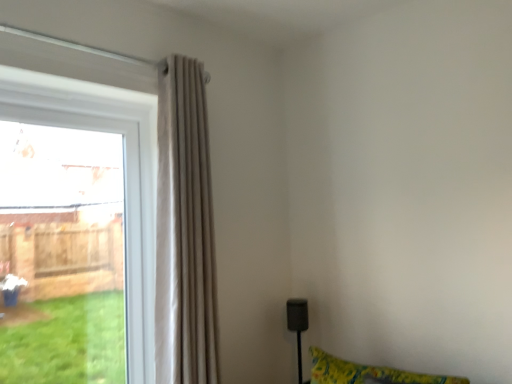
I want to click on beige fabric curtain at left, so click(x=184, y=230).

Describe the element at coordinates (184, 230) in the screenshot. I see `beige fabric curtain at left` at that location.

Image resolution: width=512 pixels, height=384 pixels. What do you see at coordinates (146, 192) in the screenshot?
I see `clear glass window at left` at bounding box center [146, 192].

Where is `clear glass window at left`? clear glass window at left is located at coordinates (146, 192).

Locate an element on the screen. beige fabric curtain at left is located at coordinates (184, 230).

In the image, is clear glass window at left on the left side or the right side of beige fabric curtain at left?

clear glass window at left is to the left of beige fabric curtain at left.

Which is behind, clear glass window at left or beige fabric curtain at left?

Positioned behind is clear glass window at left.

Is point (164, 325) more distant than point (203, 211)?

No.

From the image's perspective, which object appears higher, clear glass window at left or beige fabric curtain at left?

beige fabric curtain at left appears higher in the image.

From a real-world perspective, between clear glass window at left and beige fabric curtain at left, who is vertically higher?

In real-world perspective, beige fabric curtain at left is above.

Which of these two, clear glass window at left or beige fabric curtain at left, is thinner?

Thinner between the two is clear glass window at left.

Is clear glass window at left taller than beige fabric curtain at left?

No.

Considering the sizes of clear glass window at left and beige fabric curtain at left in the image, is clear glass window at left bigger or smaller than beige fabric curtain at left?

Clearly, clear glass window at left is smaller in size than beige fabric curtain at left.

Choose the correct answer: Is clear glass window at left inside beige fabric curtain at left or outside it?

The correct answer is: outside.

Is clear glass window at left with beige fabric curtain at left?

No, clear glass window at left is not with beige fabric curtain at left.

Is clear glass window at left aimed at beige fabric curtain at left?

Yes.

This screenshot has height=384, width=512. In order to click on curtain in front of the clear glass window at left in this screenshot , I will do `click(184, 230)`.

Considering the positions of objects beige fabric curtain at left and clear glass window at left in the image provided, who is more to the left, beige fabric curtain at left or clear glass window at left?

From the viewer's perspective, clear glass window at left appears more on the left side.

Which object is further away from the camera taking this photo, beige fabric curtain at left or clear glass window at left?

clear glass window at left.

Which point is more distant from viewer, (176, 213) or (142, 81)?

Point (142, 81)

Based on the photo, from the image's perspective, is beige fabric curtain at left above or below clear glass window at left?

beige fabric curtain at left is situated higher than clear glass window at left in the image.

From a real-world perspective, which is physically above, beige fabric curtain at left or clear glass window at left?

beige fabric curtain at left is physically above.

Is beige fabric curtain at left wider or thinner than clear glass window at left?

Clearly, beige fabric curtain at left has more width compared to clear glass window at left.

Considering the relative sizes of beige fabric curtain at left and clear glass window at left in the image provided, is beige fabric curtain at left shorter than clear glass window at left?

Incorrect, the height of beige fabric curtain at left does not fall short of that of clear glass window at left.

Is beige fabric curtain at left smaller than clear glass window at left?

Actually, beige fabric curtain at left might be larger than clear glass window at left.

In the scene shown: Is clear glass window at left inside beige fabric curtain at left?

No.

Is beige fabric curtain at left beside clear glass window at left?

They are not placed beside each other.

Is beige fabric curtain at left looking in the opposite direction of clear glass window at left?

beige fabric curtain at left does not have its back to clear glass window at left.

How different are the orientations of beige fabric curtain at left and clear glass window at left in degrees?

They differ by 4.02 degrees in their facing directions.

Locate an element on the screen. The width and height of the screenshot is (512, 384). curtain above the clear glass window at left (from a real-world perspective) is located at coordinates (184, 230).

The height and width of the screenshot is (384, 512). What are the coordinates of `window that is behind the beige fabric curtain at left` in the screenshot? It's located at (146, 192).

Locate an element on the screen. curtain on the right of the clear glass window at left is located at coordinates (184, 230).